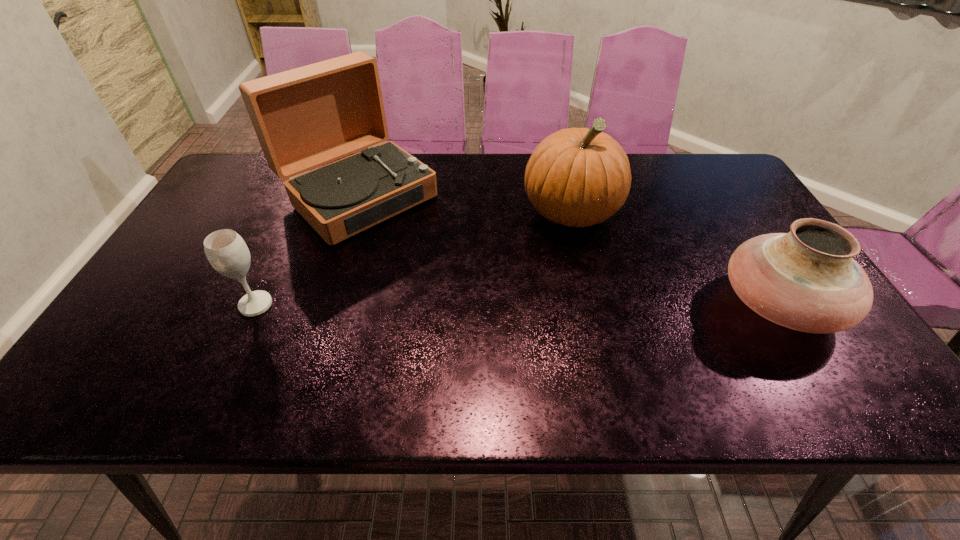
Where is `wineglass`? The height and width of the screenshot is (540, 960). wineglass is located at coordinates (226, 251).

Find the location of a particular element. The width and height of the screenshot is (960, 540). the rightmost object is located at coordinates (807, 280).

The width and height of the screenshot is (960, 540). I want to click on pumpkin, so click(577, 177).

This screenshot has height=540, width=960. Find the location of `phonograph record`. phonograph record is located at coordinates (306, 117).

What are the coordinates of `free location located 0.270m on the back of the wineglass` in the screenshot? It's located at (294, 222).

Image resolution: width=960 pixels, height=540 pixels. I want to click on vacant space located on the back of the pottery, so click(x=734, y=232).

Image resolution: width=960 pixels, height=540 pixels. In order to click on free space located 0.150m on the stem of the pumpkin in this screenshot , I will do `click(559, 282)`.

The height and width of the screenshot is (540, 960). I want to click on vacant region located on the stem of the pumpkin, so click(x=555, y=306).

Locate an element on the screen. The image size is (960, 540). vacant area situated on the stem of the pumpkin is located at coordinates (555, 306).

I want to click on free space located on the face of the phonograph record, so click(x=416, y=246).